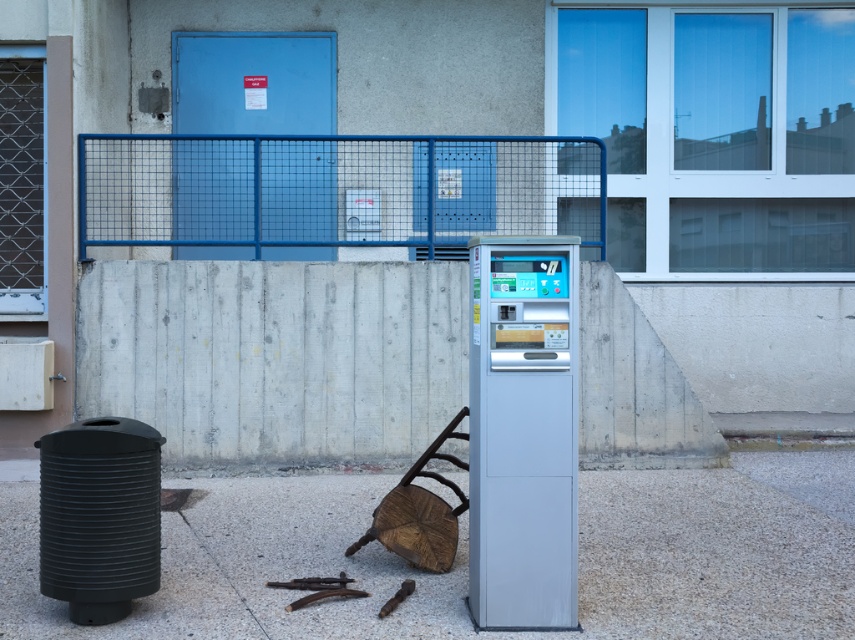
Question: Which object is the farthest from the satin silver machine at center?

Choices:
 (A) blue wire mesh fence at upper center
 (B) gray concrete pavement at center

Answer: (A)

Question: Estimate the real-world distances between objects in this image. Which object is farther from the black ribbed trash can at lower left?

Choices:
 (A) gray concrete pavement at center
 (B) satin silver machine at center

Answer: (A)

Question: Does blue wire mesh fence at upper center lie behind satin silver machine at center?

Choices:
 (A) yes
 (B) no

Answer: (A)

Question: Among these points, which one is nearest to the camera?

Choices:
 (A) (450, 250)
 (B) (56, 579)
 (C) (552, 392)
 (D) (158, 630)

Answer: (C)

Question: Is gray concrete pavement at center bigger than black ribbed trash can at lower left?

Choices:
 (A) no
 (B) yes

Answer: (A)

Question: Is gray concrete pavement at center to the right of blue wire mesh fence at upper center from the viewer's perspective?

Choices:
 (A) no
 (B) yes

Answer: (B)